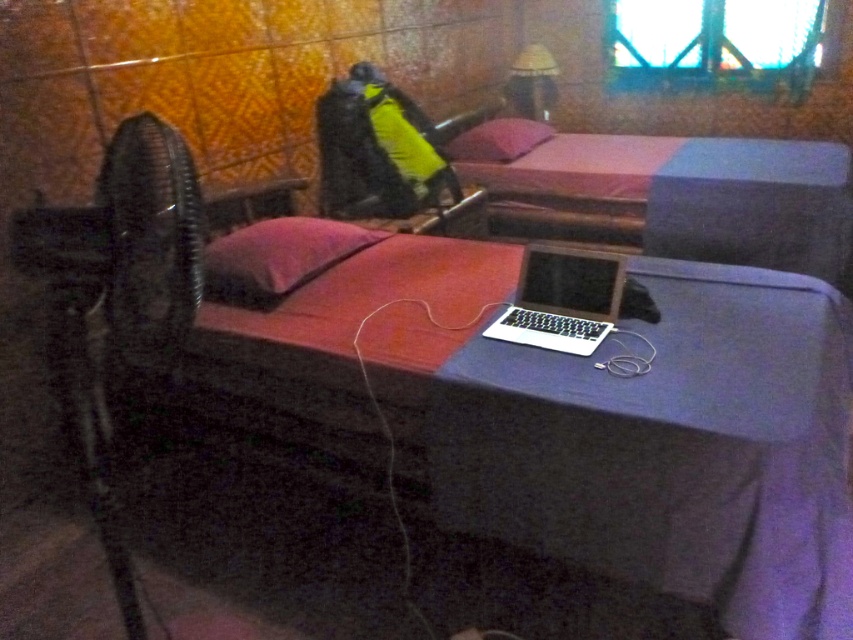
You are trying to move a small rectangular box from the black plastic fan at left to the pink fabric pillow at center. Which object will the box encounter first if it rolls straight forward?

The box will encounter the pink fabric pillow at center first because the black plastic fan at left is thinner than the pink fabric pillow at center, meaning the pillow extends further into the space.

You are trying to find the silver metallic laptop at center in the dimly lit room. According to the scene, where would you look relative to the pink fabric pillow at center?

The silver metallic laptop at center is positioned under the pink fabric pillow at center, so you should look below the pink fabric pillow at center to find it.